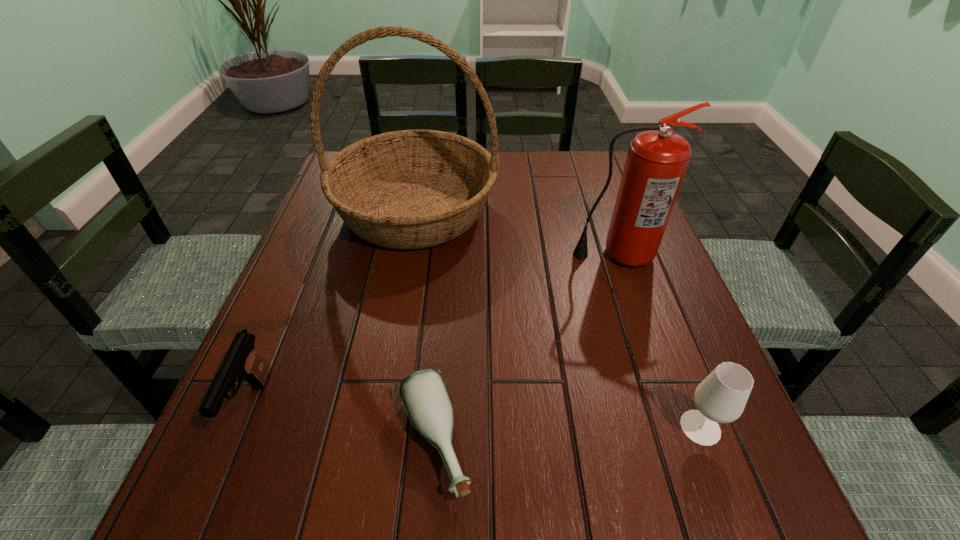
In order to click on object that is at the far edge in this screenshot , I will do `click(411, 189)`.

Find the location of a particular element. The height and width of the screenshot is (540, 960). object that is at the near edge is located at coordinates (424, 395).

You are a GUI agent. You are given a task and a screenshot of the screen. Output one action in this format:
    pyautogui.click(x=<x>, y=<y>)
    Task: Click on the basket at the left edge
    The width and height of the screenshot is (960, 540).
    Given the screenshot: What is the action you would take?
    pyautogui.click(x=411, y=189)

Image resolution: width=960 pixels, height=540 pixels. In order to click on pistol that is at the left edge in this screenshot , I will do `click(242, 360)`.

Identify the location of fire extinguisher that is positioned at the right edge. This screenshot has height=540, width=960. (657, 160).

Find the location of `glass present at the right edge`. glass present at the right edge is located at coordinates (721, 397).

You are a GUI agent. You are given a task and a screenshot of the screen. Output one action in this format:
    pyautogui.click(x=<x>, y=<y>)
    Task: Click on the object located in the far left corner section of the desktop
    The height and width of the screenshot is (540, 960).
    Given the screenshot: What is the action you would take?
    pyautogui.click(x=411, y=189)

Identify the location of vacant region at the far edge of the desktop. (507, 158).

In the image, there is a desktop. Find the location of `vacant region at the near edge`. vacant region at the near edge is located at coordinates (468, 502).

In the image, there is a desktop. What are the coordinates of `blank space at the right edge` in the screenshot? It's located at (753, 462).